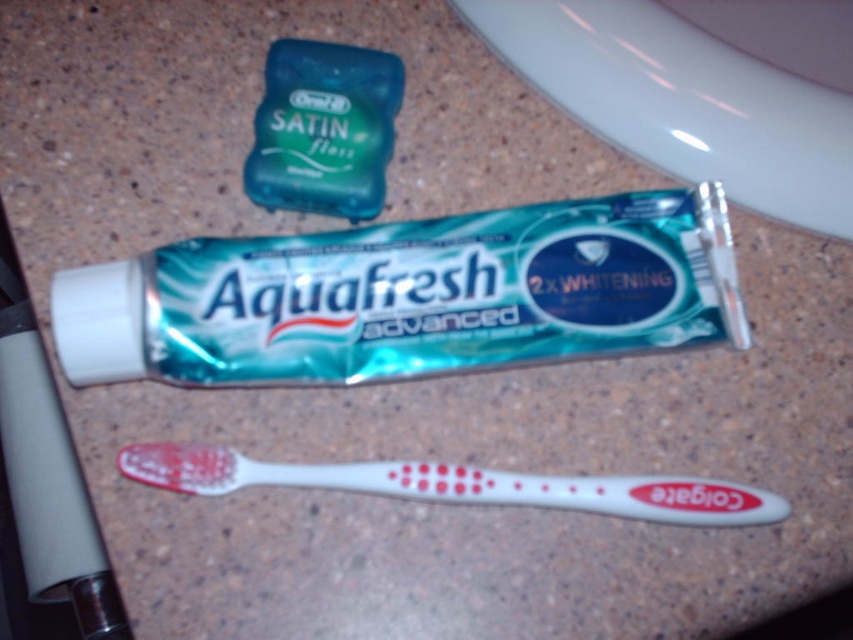
Is green glossy toothpaste at center above white plastic toothbrush at lower center?

Yes.

Can you confirm if green glossy toothpaste at center is shorter than white plastic toothbrush at lower center?

No, green glossy toothpaste at center is not shorter than white plastic toothbrush at lower center.

Is point (212, 292) positioned behind point (579, 508)?

No, it is in front of (579, 508).

Identify the location of green glossy toothpaste at center. Image resolution: width=853 pixels, height=640 pixels. (x=410, y=296).